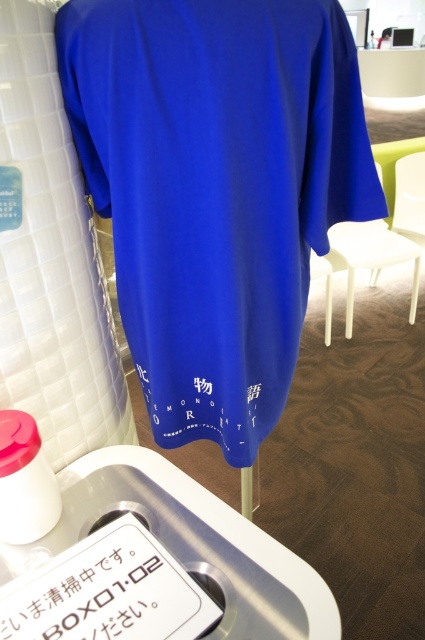
Question: Is white paper at lower center closer to the viewer compared to white plastic chair at right?

Choices:
 (A) yes
 (B) no

Answer: (A)

Question: Which of the following is the farthest from the observer?

Choices:
 (A) (175, 64)
 (B) (268, 616)
 (C) (5, 632)

Answer: (A)

Question: Which point is closer to the camera taking this photo?

Choices:
 (A) (44, 614)
 (B) (348, 307)
 (C) (212, 109)

Answer: (A)

Question: Does matte blue t-shirt at center appear on the right side of white plastic chair at right?

Choices:
 (A) yes
 (B) no

Answer: (B)

Question: Is matte blue t-shirt at center wider than white paper at lower center?

Choices:
 (A) no
 (B) yes

Answer: (B)

Question: Estimate the real-world distances between objects in this image. Which object is closer to the white paper at lower center?

Choices:
 (A) white plastic chair at right
 (B) white plastic sink at lower left
 (C) matte blue t-shirt at center

Answer: (B)